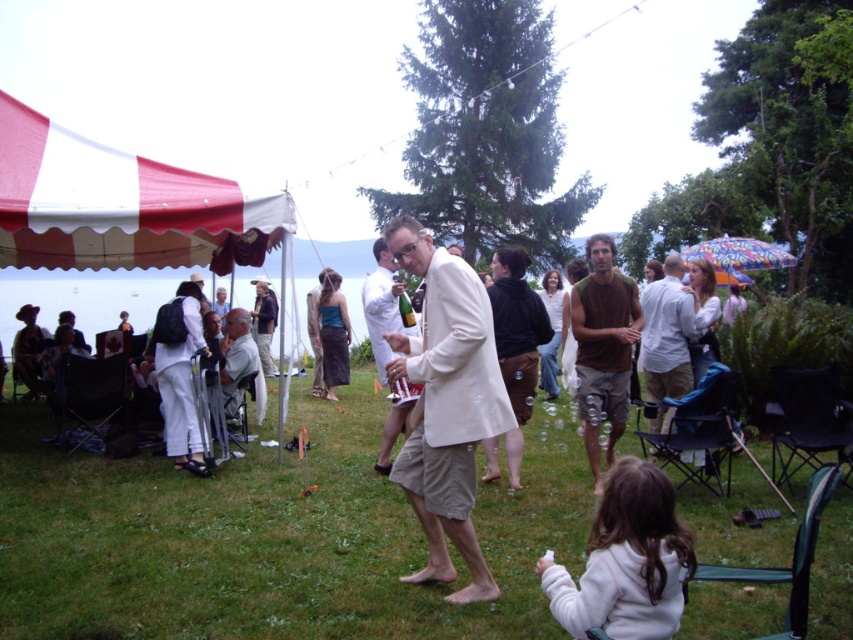
How distant is light beige suit at center from light gray suit at center?

light beige suit at center is 1.69 meters away from light gray suit at center.

Which is more to the left, light beige suit at center or light gray suit at center?

From the viewer's perspective, light gray suit at center appears more on the left side.

Is point (376, 285) positioned behind point (225, 355)?

No, it is in front of (225, 355).

I want to click on light beige suit at center, so click(x=381, y=307).

Who is more forward, (45, 225) or (434, 250)?

Point (434, 250)

Is the position of red and white striped canopy at left more distant than that of light beige fabric jacket at center?

That is True.

Is point (18, 132) farther from viewer compared to point (419, 256)?

Yes, it is.

You are a GUI agent. You are given a task and a screenshot of the screen. Output one action in this format:
    pyautogui.click(x=<x>, y=<y>)
    Task: Click on the red and white striped canopy at left
    
    Given the screenshot: What is the action you would take?
    pyautogui.click(x=120, y=205)

Which is more to the left, light beige fabric jacket at center or brown cotton t-shirt at center?

From the viewer's perspective, light beige fabric jacket at center appears more on the left side.

Does light beige fabric jacket at center have a smaller size compared to brown cotton t-shirt at center?

Actually, light beige fabric jacket at center might be larger than brown cotton t-shirt at center.

Find the location of `light beige fabric jacket at center`. light beige fabric jacket at center is located at coordinates (445, 404).

Find the location of a particular element. light beige fabric jacket at center is located at coordinates (445, 404).